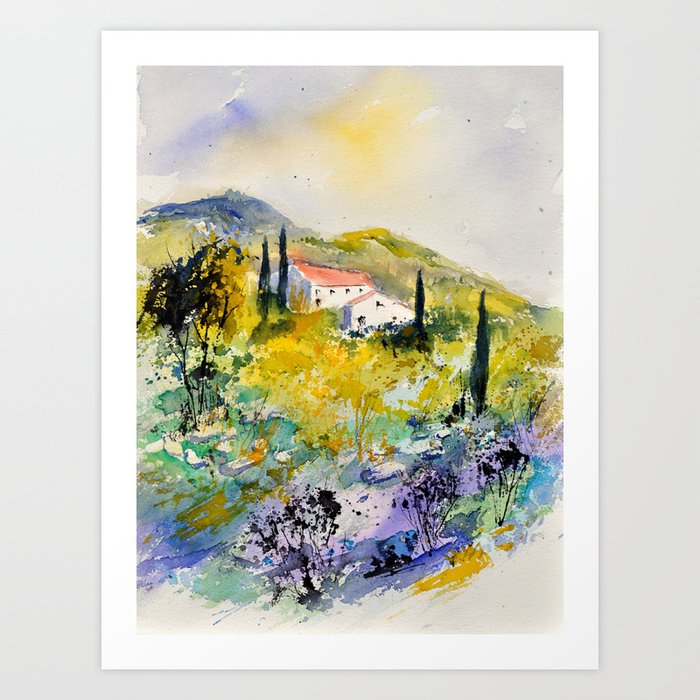
At what (x,y) coordinates should I click in order to perform the action: click on hotel. Please return your answer as a coordinate pair (x, y). This screenshot has width=700, height=700. Looking at the image, I should click on (371, 311).